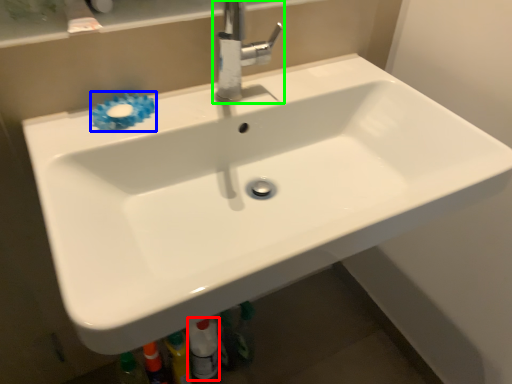
Question: Which is nearer to the toiletry (highlighted by a red box)? flower (highlighted by a blue box) or tap (highlighted by a green box).

Choices:
 (A) flower
 (B) tap

Answer: (A)